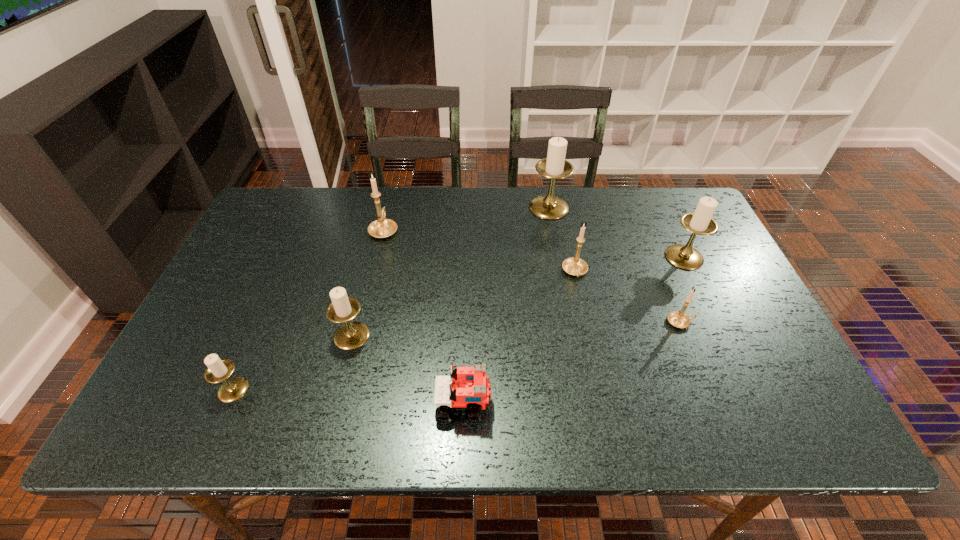
I want to click on object that is at the near left corner, so click(x=218, y=370).

At what (x,y) coordinates should I click in order to perform the action: click on vacant area at the far edge. Please return your answer as a coordinate pair (x, y). This screenshot has width=960, height=540. Looking at the image, I should click on (637, 203).

In the image, there is a desktop. What are the coordinates of `free region at the left edge` in the screenshot? It's located at (251, 266).

At what (x,y) coordinates should I click in order to perform the action: click on free space at the right edge of the desktop. Please return your answer as a coordinate pair (x, y). The height and width of the screenshot is (540, 960). Looking at the image, I should click on (756, 367).

Image resolution: width=960 pixels, height=540 pixels. What are the coordinates of `vacant region at the near left corner of the desktop` in the screenshot? It's located at (220, 402).

Where is `free space between the rightmost gold candle holder and the biggest gold candle holder`? free space between the rightmost gold candle holder and the biggest gold candle holder is located at coordinates (532, 276).

The width and height of the screenshot is (960, 540). Find the location of `unoccupied position between the smallest white candle holder and the rightmost white candle holder`. unoccupied position between the smallest white candle holder and the rightmost white candle holder is located at coordinates (459, 323).

Where is `free space that is in between the tallest candle holder and the second nearest gold candle holder`? free space that is in between the tallest candle holder and the second nearest gold candle holder is located at coordinates (562, 240).

At what (x,y) coordinates should I click in order to perform the action: click on free spot between the leftmost candle holder and the tallest object. Please return your answer as a coordinate pair (x, y). The height and width of the screenshot is (540, 960). Looking at the image, I should click on (391, 299).

I want to click on unoccupied position between the second white candle holder from right to left and the second biggest white candle holder, so click(x=616, y=232).